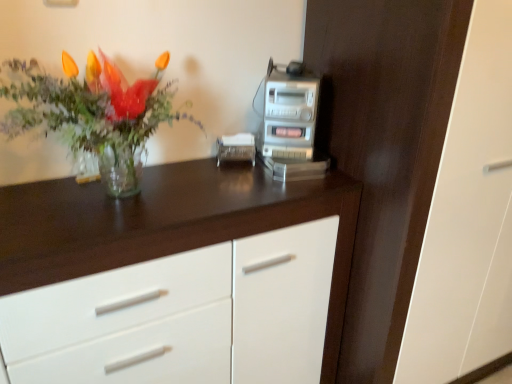
Measure the distance between point (128, 175) and camera.

Point (128, 175) and camera are 1.10 meters apart from each other.

Measure the distance between point [406,101] and camera.

3.48 feet.

This screenshot has height=384, width=512. I want to click on silver metallic stereo at upper right, so coord(289,123).

What are the coordinates of `transparent glass vase at left` in the screenshot? It's located at (90, 109).

Is transparent glass vase at left taller than silver metallic stereo at upper right?

Yes.

Is transparent glass vase at left aimed at silver metallic stereo at upper right?

No.

From the image's perspective, between transparent glass vase at left and silver metallic stereo at upper right, which one is located above?

silver metallic stereo at upper right is shown above in the image.

You are a GUI agent. You are given a task and a screenshot of the screen. Output one action in this format:
    pyautogui.click(x=<x>, y=<y>)
    Task: Click on the houseplant that appears on the left of silver metallic stereo at upper right
    The height and width of the screenshot is (384, 512).
    Given the screenshot: What is the action you would take?
    pyautogui.click(x=90, y=109)

Which object is wider, silver metallic stereo at upper right or white glossy chest of drawers at center?

With larger width is white glossy chest of drawers at center.

Where is `chest of drawers on the left of silver metallic stereo at upper right`? The height and width of the screenshot is (384, 512). chest of drawers on the left of silver metallic stereo at upper right is located at coordinates (168, 224).

Does point (303, 123) appear closer or farther from the camera than point (155, 178)?

Clearly, point (303, 123) is closer to the camera than point (155, 178).

Relative to white glossy chest of drawers at center, is silver metallic stereo at upper right in front or behind?

silver metallic stereo at upper right is positioned farther from the viewer than white glossy chest of drawers at center.

Could you tell me if transparent glass vase at left is facing white glossy chest of drawers at center?

No, transparent glass vase at left is not aimed at white glossy chest of drawers at center.

The width and height of the screenshot is (512, 384). Find the location of `chest of drawers on the right of transparent glass vase at left`. chest of drawers on the right of transparent glass vase at left is located at coordinates (168, 224).

From the image's perspective, is transparent glass vase at left beneath white glossy chest of drawers at center?

No, from the image's perspective, transparent glass vase at left is not beneath white glossy chest of drawers at center.

Identify the location of chest of drawers lying on the left of silver metallic stereo at upper right. The image size is (512, 384). (168, 224).

Is white glossy chest of drawers at center wider or thinner than silver metallic stereo at upper right?

white glossy chest of drawers at center is wider than silver metallic stereo at upper right.

Is silver metallic stereo at upper right completely or partially inside white glossy chest of drawers at center?

No, silver metallic stereo at upper right is located outside of white glossy chest of drawers at center.

Is point (8, 235) farther from viewer compared to point (307, 153)?

That is False.

Is white glossy chest of drawers at center turned away from dark wood dresser at center?

No, white glossy chest of drawers at center's orientation is not away from dark wood dresser at center.

From a real-world perspective, is white glossy chest of drawers at center physically located above or below dark wood dresser at center?

white glossy chest of drawers at center is situated lower than dark wood dresser at center in the real world.

Is white glossy chest of drawers at center further to the viewer compared to dark wood dresser at center?

No, white glossy chest of drawers at center is closer to the camera.

How many degrees apart are the facing directions of white glossy chest of drawers at center and dark wood dresser at center?

The angular difference between white glossy chest of drawers at center and dark wood dresser at center is 2.37 degrees.

Consider the image. Which is more to the left, silver metallic stereo at upper right or transparent glass vase at left?

From the viewer's perspective, transparent glass vase at left appears more on the left side.

Is silver metallic stereo at upper right positioned before transparent glass vase at left?

No, it is behind transparent glass vase at left.

Is silver metallic stereo at upper right taller or shorter than transparent glass vase at left?

Clearly, silver metallic stereo at upper right is shorter compared to transparent glass vase at left.

How distant is dark wood dresser at center from white glossy chest of drawers at center?

32.88 centimeters.

Consider the image. Can you confirm if dark wood dresser at center is thinner than white glossy chest of drawers at center?

No, dark wood dresser at center is not thinner than white glossy chest of drawers at center.

Considering the relative sizes of dark wood dresser at center and white glossy chest of drawers at center in the image provided, is dark wood dresser at center bigger than white glossy chest of drawers at center?

Indeed, dark wood dresser at center has a larger size compared to white glossy chest of drawers at center.

From the picture: What's the angular difference between dark wood dresser at center and white glossy chest of drawers at center's facing directions?

dark wood dresser at center and white glossy chest of drawers at center are facing 2.37 degrees away from each other.

You are a GUI agent. You are given a task and a screenshot of the screen. Output one action in this format:
    pyautogui.click(x=<x>, y=<y>)
    Task: Click on the appliance above the transparent glass vase at left (from the image's perspective)
    
    Given the screenshot: What is the action you would take?
    pyautogui.click(x=289, y=123)

Identify the location of the chest of drawers in front of the silver metallic stereo at upper right. Image resolution: width=512 pixels, height=384 pixels. (168, 224).

From the image, which object appears to be farther from transparent glass vase at left, dark wood dresser at center or white glossy chest of drawers at center?

Among the two, dark wood dresser at center is located further to transparent glass vase at left.

Estimate the real-world distances between objects in this image. Which object is further from dark wood dresser at center, silver metallic stereo at upper right or transparent glass vase at left?

transparent glass vase at left.

Based on the photo, estimate the real-world distances between objects in this image. Which object is further from silver metallic stereo at upper right, white glossy chest of drawers at center or transparent glass vase at left?

transparent glass vase at left is further to silver metallic stereo at upper right.

Estimate the real-world distances between objects in this image. Which object is further from silver metallic stereo at upper right, dark wood dresser at center or transparent glass vase at left?

transparent glass vase at left is further to silver metallic stereo at upper right.

Which object lies nearer to the anchor point transparent glass vase at left, dark wood dresser at center or silver metallic stereo at upper right?

silver metallic stereo at upper right.

Looking at the image, which one is located closer to silver metallic stereo at upper right, white glossy chest of drawers at center or dark wood dresser at center?

dark wood dresser at center is closer to silver metallic stereo at upper right.

Which object lies further to the anchor point white glossy chest of drawers at center, silver metallic stereo at upper right or transparent glass vase at left?

Based on the image, silver metallic stereo at upper right appears to be further to white glossy chest of drawers at center.

Looking at the image, which one is located further to silver metallic stereo at upper right, dark wood dresser at center or white glossy chest of drawers at center?

white glossy chest of drawers at center is further to silver metallic stereo at upper right.

The image size is (512, 384). I want to click on houseplant between silver metallic stereo at upper right and white glossy chest of drawers at center vertically, so click(x=90, y=109).

The width and height of the screenshot is (512, 384). I want to click on appliance between transparent glass vase at left and dark wood dresser at center in the horizontal direction, so click(x=289, y=123).

This screenshot has width=512, height=384. Identify the location of chest of drawers between transparent glass vase at left and dark wood dresser at center. (168, 224).

Find the location of a particular element. appliance located between white glossy chest of drawers at center and dark wood dresser at center in the left-right direction is located at coordinates (289, 123).